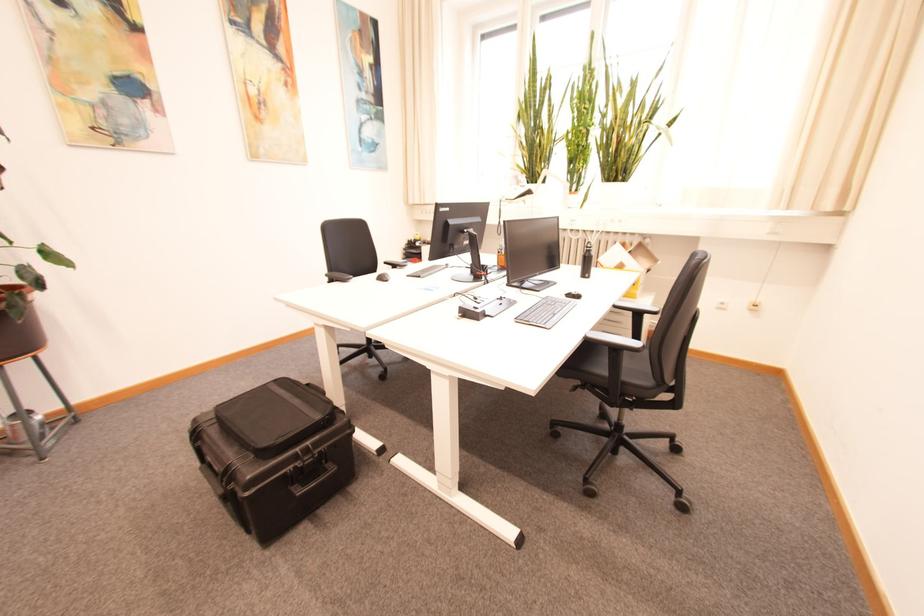
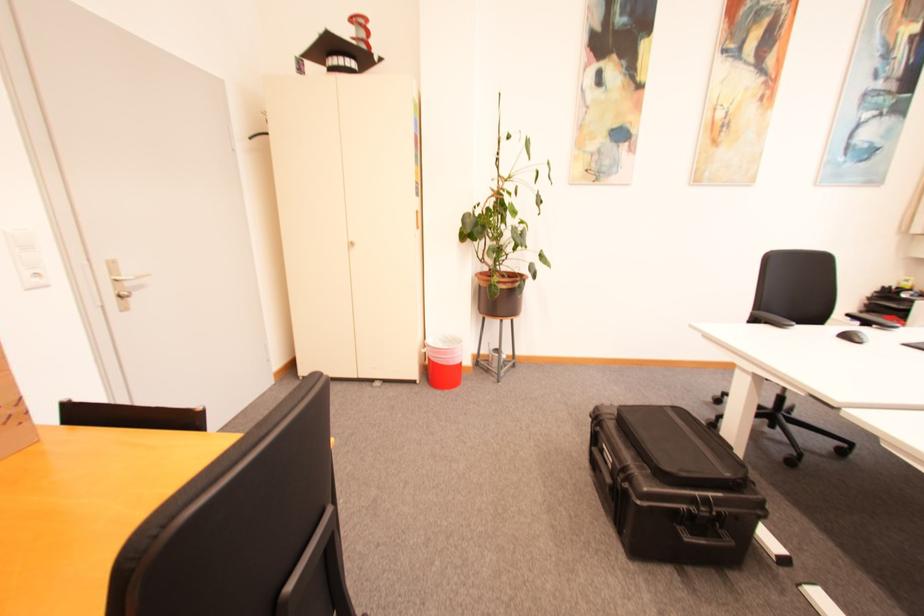
Question: The first image is from the beginning of the video and the second image is from the end. How did the camera likely rotate when shooting the video?

Choices:
 (A) Left
 (B) Right
 (C) Up
 (D) Down

Answer: (A)